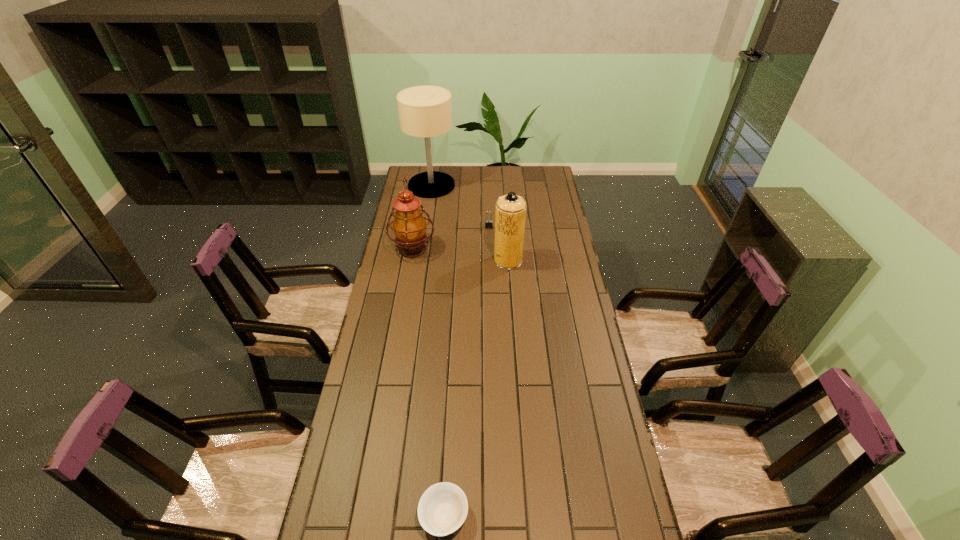
This screenshot has width=960, height=540. I want to click on free space between the oil lamp and the fourth tallest object, so click(451, 238).

Identify the location of free point between the aerosol can and the tallest object. (469, 223).

At what (x,y) coordinates should I click in order to perform the action: click on vacant area between the padlock and the table lamp. Please return your answer as a coordinate pair (x, y). The width and height of the screenshot is (960, 540). Looking at the image, I should click on coord(460,206).

I want to click on object that stands as the closest to the shortest object, so (x=510, y=213).

Identify which object is located as the nearest to the aerosol can. Please provide its 2D coordinates. Your answer should be formatted as a tuple, i.e. [(x, y)], where the tuple contains the x and y coordinates of a point satisfying the conditions above.

[(488, 223)]

This screenshot has height=540, width=960. I want to click on vacant region that satisfies the following two spatial constraints: 1. on the shackle of the aerosol can; 2. on the left side of the padlock, so click(490, 260).

At what (x,y) coordinates should I click in order to perform the action: click on free region that satisfies the following two spatial constraints: 1. on the front side of the aerosol can; 2. on the left side of the tallest object. Please return your answer as a coordinate pair (x, y). The image size is (960, 540). Looking at the image, I should click on (420, 260).

Locate an element on the screen. This screenshot has height=540, width=960. vacant area that satisfies the following two spatial constraints: 1. on the shackle of the aerosol can; 2. on the right side of the fourth tallest object is located at coordinates coord(490,260).